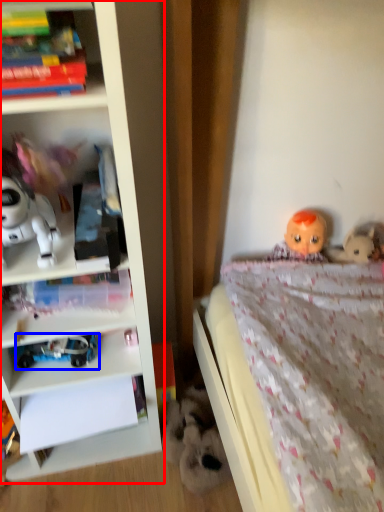
Question: Which point is closer to the camera, bookcase (highlighted by a red box) or toy (highlighted by a blue box)?

Choices:
 (A) bookcase
 (B) toy

Answer: (A)